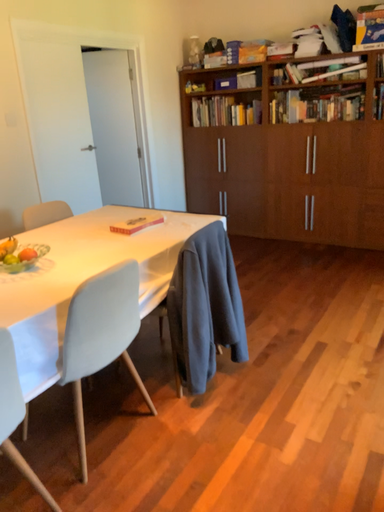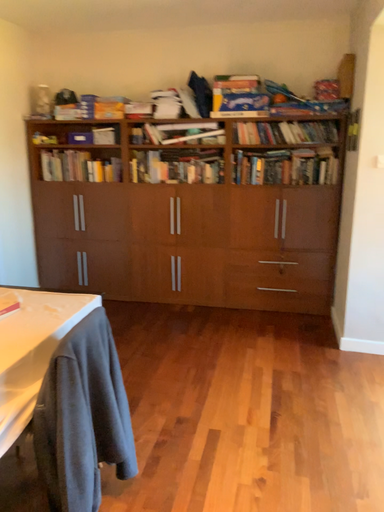
Question: How did the camera likely rotate when shooting the video?

Choices:
 (A) rotated downward
 (B) rotated upward

Answer: (B)